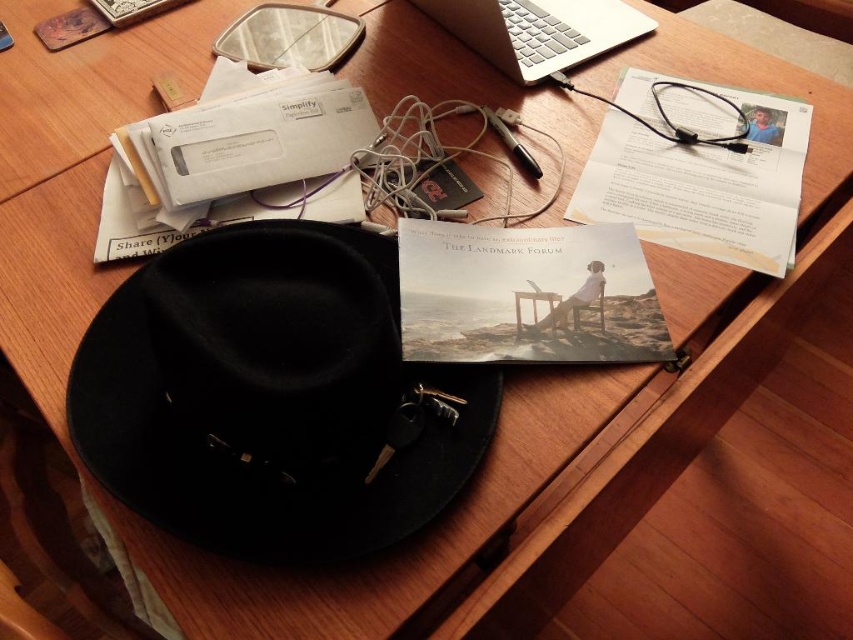
Question: Can you confirm if white paper at upper right is bigger than silver metallic laptop at upper center?

Choices:
 (A) no
 (B) yes

Answer: (B)

Question: Which of the following is the closest to the observer?

Choices:
 (A) silver metallic laptop at upper center
 (B) black felt fedora at lower left
 (C) white paper at upper right

Answer: (B)

Question: Is black felt fedora at lower left above white paper at upper right?

Choices:
 (A) no
 (B) yes

Answer: (A)

Question: Which object is positioned closest to the silver metallic laptop at upper center?

Choices:
 (A) white paper at upper right
 (B) black felt fedora at lower left

Answer: (A)

Question: Is black felt fedora at lower left below silver metallic laptop at upper center?

Choices:
 (A) yes
 (B) no

Answer: (A)

Question: Considering the real-world distances, which object is farthest from the silver metallic laptop at upper center?

Choices:
 (A) black felt fedora at lower left
 (B) white paper at upper right

Answer: (A)